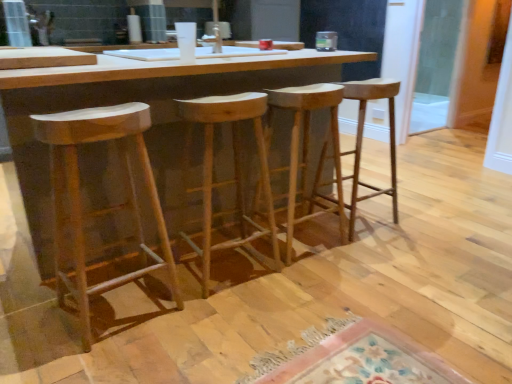
Find the location of a particular element. This screenshot has height=384, width=512. vacant space underneath natural wood stool at center, the 2th stool when ordered from right to left (from a real-world perspective) is located at coordinates (307, 241).